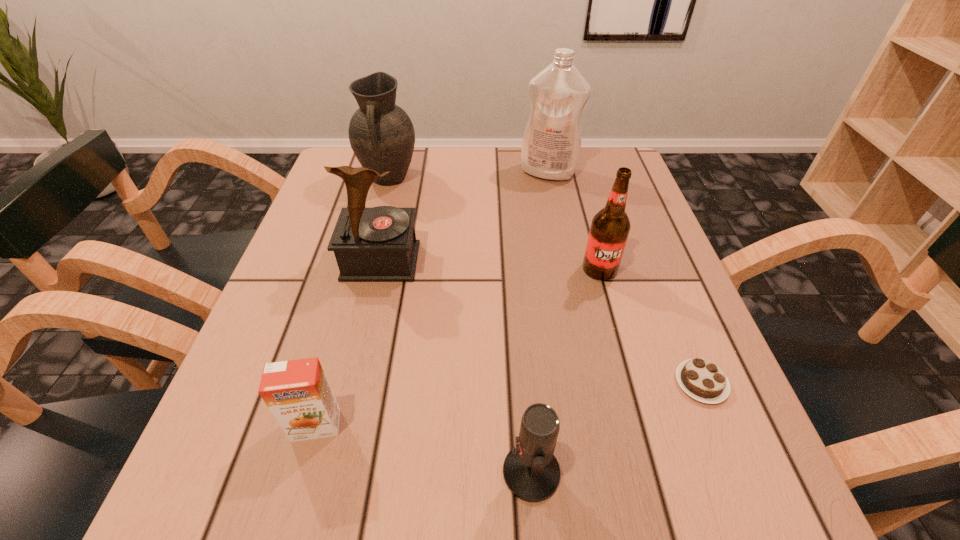
Find the location of a particular element. The height and width of the screenshot is (540, 960). blank area in the image that satisfies the following two spatial constraints: 1. on the front side of the root beer; 2. on the right side of the shortest object is located at coordinates (631, 383).